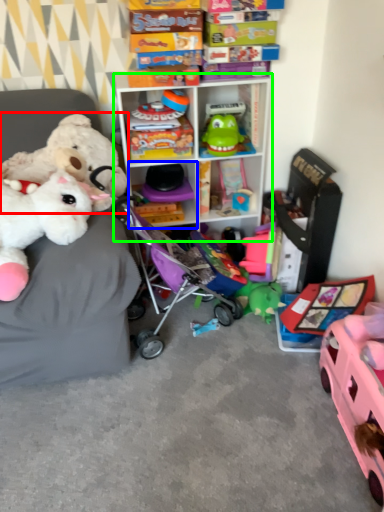
Question: Which object is the farthest from toy (highlighted by a red box)? Choose among these: shelf (highlighted by a blue box) or shelf (highlighted by a green box).

Choices:
 (A) shelf
 (B) shelf

Answer: (A)